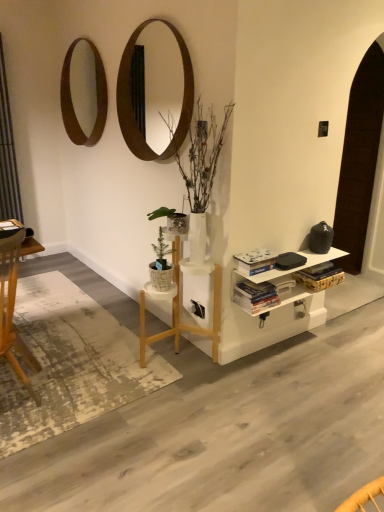
Question: Does hardcover books at center, placed as the first book when sorted from bottom to top, have a greater height compared to wooden mirror at upper center, which ranks as the 2th mirror in left-to-right order?

Choices:
 (A) yes
 (B) no

Answer: (B)

Question: Could you tell me if hardcover books at center, placed as the first book when sorted from bottom to top, is facing wooden mirror at upper center, which is the first mirror in front-to-back order?

Choices:
 (A) no
 (B) yes

Answer: (A)

Question: Considering the relative positions of hardcover books at center, the second book positioned from the top, and wooden mirror at upper center, placed as the second mirror when sorted from back to front, in the image provided, is hardcover books at center, the second book positioned from the top, to the left of wooden mirror at upper center, placed as the second mirror when sorted from back to front, from the viewer's perspective?

Choices:
 (A) yes
 (B) no

Answer: (B)

Question: Considering the relative sizes of hardcover books at center, placed as the first book when sorted from bottom to top, and wooden mirror at upper center, which ranks as the 2th mirror in left-to-right order, in the image provided, is hardcover books at center, placed as the first book when sorted from bottom to top, thinner than wooden mirror at upper center, which ranks as the 2th mirror in left-to-right order,?

Choices:
 (A) yes
 (B) no

Answer: (B)

Question: Can you confirm if hardcover books at center, the second book positioned from the top, is shorter than wooden mirror at upper center, which ranks as the 2th mirror in left-to-right order?

Choices:
 (A) no
 (B) yes

Answer: (B)

Question: Is wooden mirror at upper center, which is the first mirror in front-to-back order, at the back of hardcover books at center, placed as the first book when sorted from bottom to top?

Choices:
 (A) no
 (B) yes

Answer: (A)

Question: Could white painted wood shelf at lower right be considered to be inside wooden desk at left?

Choices:
 (A) yes
 (B) no

Answer: (B)

Question: From a real-world perspective, is wooden desk at left located higher than white painted wood shelf at lower right?

Choices:
 (A) no
 (B) yes

Answer: (B)

Question: Is wooden desk at left smaller than white painted wood shelf at lower right?

Choices:
 (A) yes
 (B) no

Answer: (B)

Question: From the image's perspective, is wooden desk at left located beneath white painted wood shelf at lower right?

Choices:
 (A) yes
 (B) no

Answer: (B)

Question: From a real-world perspective, is wooden desk at left located beneath white painted wood shelf at lower right?

Choices:
 (A) no
 (B) yes

Answer: (A)

Question: Considering the relative sizes of wooden desk at left and white painted wood shelf at lower right in the image provided, is wooden desk at left shorter than white painted wood shelf at lower right?

Choices:
 (A) yes
 (B) no

Answer: (B)

Question: Could you tell me if green leafy plant at center is turned towards hardcover book at center, acting as the 1th book starting from the top?

Choices:
 (A) yes
 (B) no

Answer: (B)